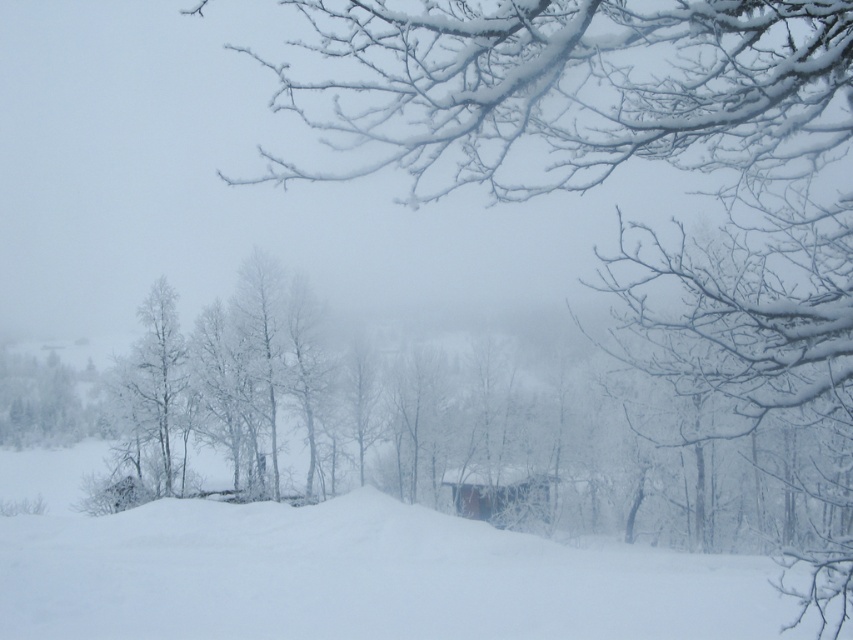
You are an explorer trying to find shelter in this winter scene. You see a green matte tree at left and a wooden cabin at center. Which object is closer to the left edge of the image?

The green matte tree at left is positioned on the left side of the wooden cabin at center, so it is closer to the left edge of the image.

You are planning to build a small shed in the winter landscape scene. The shed needs to be placed near the wooden cabin at center. Considering the green matte tree at left is taller than the cabin, will the shed receive enough sunlight if placed there?

The green matte tree at left is taller than the wooden cabin at center, so it may cast a shadow over the shed if placed near the cabin. This could reduce the amount of sunlight the shed receives.

You are standing at the edge of the snowy landscape and see the green matte tree at left and the wooden cabin at center. Which object is positioned higher in the image?

The green matte tree at left is positioned higher than the wooden cabin at center in the image.